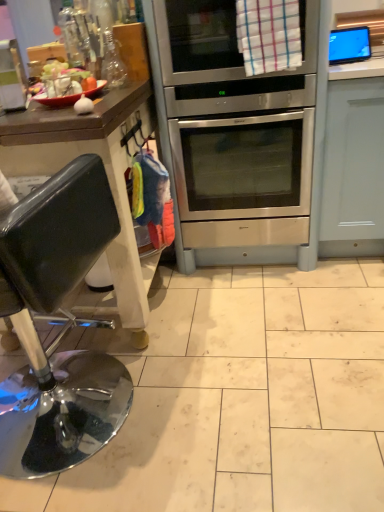
Where is `free location in front of flat screen tv at upper right`? free location in front of flat screen tv at upper right is located at coordinates (357, 69).